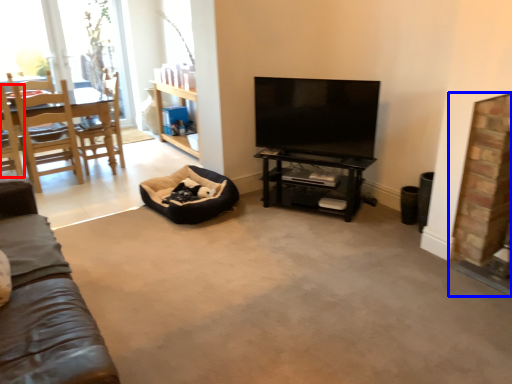
Question: Which point is further to the camera, chair (highlighted by a red box) or fireplace (highlighted by a blue box)?

Choices:
 (A) chair
 (B) fireplace

Answer: (A)